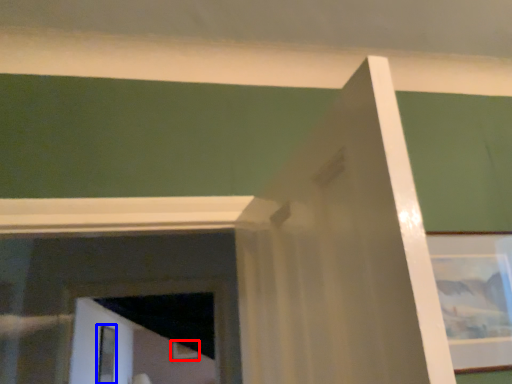
Question: Which object appears farthest to the camera in this image, picture frame (highlighted by a red box) or screen door (highlighted by a blue box)?

Choices:
 (A) picture frame
 (B) screen door

Answer: (A)